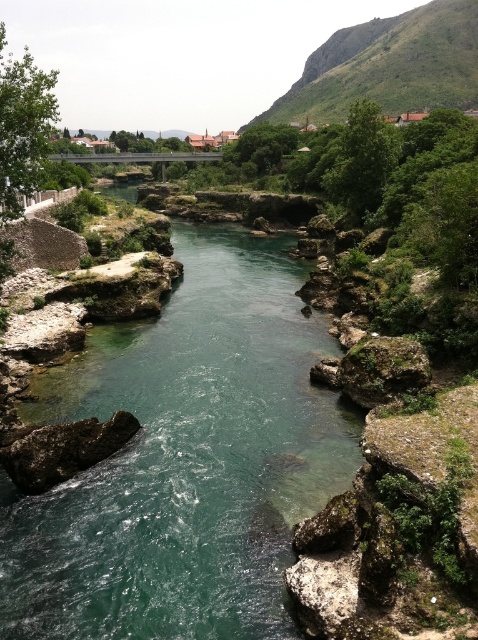
Does clear water at center appear on the right side of rough brown rock at lower left?

Yes, clear water at center is to the right of rough brown rock at lower left.

Between clear water at center and rough brown rock at lower left, which one is positioned higher?

clear water at center is higher up.

Who is more forward, (111,412) or (45,432)?

Point (45,432) is in front.

The width and height of the screenshot is (478, 640). I want to click on clear water at center, so click(184, 460).

Is clear water at center above green grassy hillside at upper right?

Actually, clear water at center is below green grassy hillside at upper right.

From the picture: Is clear water at center to the left of green grassy hillside at upper right from the viewer's perspective?

Correct, you'll find clear water at center to the left of green grassy hillside at upper right.

Who is more distant from viewer, (194, 452) or (395, 36)?

The point (395, 36) is behind.

This screenshot has height=640, width=478. I want to click on clear water at center, so click(x=184, y=460).

In the scene shown: Between green grassy hillside at upper right and rough brown rock at lower left, which one has more height?

With more height is green grassy hillside at upper right.

Does green grassy hillside at upper right appear over rough brown rock at lower left?

Yes.

Locate an element on the screen. Image resolution: width=478 pixels, height=640 pixels. green grassy hillside at upper right is located at coordinates (389, 65).

Identify the location of green grassy hillside at upper right. The width and height of the screenshot is (478, 640). (389, 65).